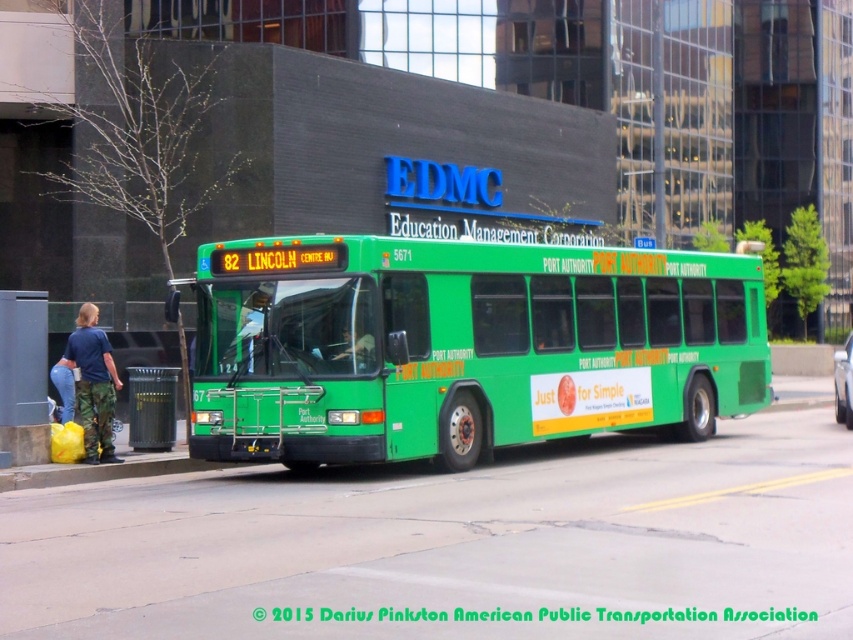
Is green matte bus at center shorter than metallic gray bus stop at lower left?

Incorrect, green matte bus at center's height does not fall short of metallic gray bus stop at lower left's.

Who is shorter, green matte bus at center or metallic gray bus stop at lower left?

metallic gray bus stop at lower left

Is point (372, 301) positioned behind point (3, 449)?

No, it is in front of (3, 449).

Where is `green matte bus at center`? The image size is (853, 640). green matte bus at center is located at coordinates (463, 346).

Is concrete at lower left to the left of matte black jacket at center from the viewer's perspective?

Correct, you'll find concrete at lower left to the left of matte black jacket at center.

Is point (28, 470) in front of point (369, 353)?

No, it is behind (369, 353).

At what (x,y) coordinates should I click in order to perform the action: click on concrete at lower left. Please return your answer as a coordinate pair (x, y). The image size is (853, 640). Looking at the image, I should click on (100, 470).

How distant is blue camouflage pants at lower left from matte black jacket at center?

They are 13.36 feet apart.

Which is more to the left, blue camouflage pants at lower left or matte black jacket at center?

blue camouflage pants at lower left is more to the left.

I want to click on blue camouflage pants at lower left, so click(93, 384).